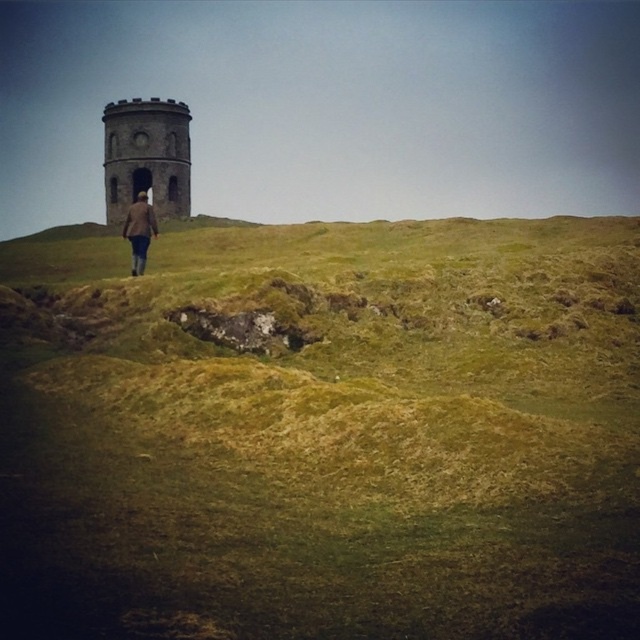
Can you confirm if green grassy hillside at center is thinner than brown woolen coat at center?

In fact, green grassy hillside at center might be wider than brown woolen coat at center.

Is point (488, 582) positioned in front of point (156, 228)?

Yes, it is.

Does point (467, 412) come in front of point (140, 237)?

Yes, point (467, 412) is in front of point (140, 237).

Where is `green grassy hillside at center`? This screenshot has width=640, height=640. green grassy hillside at center is located at coordinates (323, 433).

Who is higher up, brown stone tower at upper left or brown woolen coat at center?

brown stone tower at upper left is higher up.

Is brown stone tower at upper left to the left of brown woolen coat at center from the viewer's perspective?

Indeed, brown stone tower at upper left is positioned on the left side of brown woolen coat at center.

Locate an element on the screen. This screenshot has width=640, height=640. brown stone tower at upper left is located at coordinates (147, 156).

Between green grassy hillside at center and brown stone tower at upper left, which one appears on the right side from the viewer's perspective?

green grassy hillside at center is more to the right.

Between green grassy hillside at center and brown stone tower at upper left, which one has more height?

brown stone tower at upper left is taller.

At what (x,y) coordinates should I click in order to perform the action: click on green grassy hillside at center. Please return your answer as a coordinate pair (x, y). The height and width of the screenshot is (640, 640). Looking at the image, I should click on (323, 433).

Locate an element on the screen. The image size is (640, 640). green grassy hillside at center is located at coordinates (323, 433).